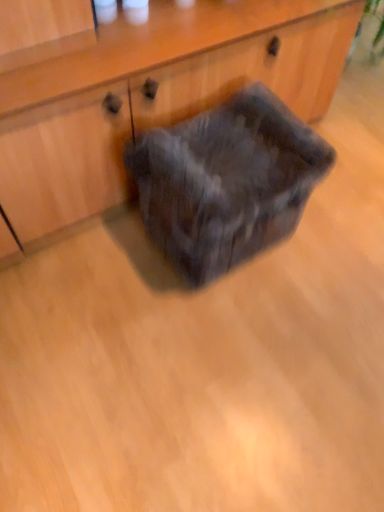
In order to click on free space to the right of textured gray fabric chair at center in this screenshot , I will do `click(329, 258)`.